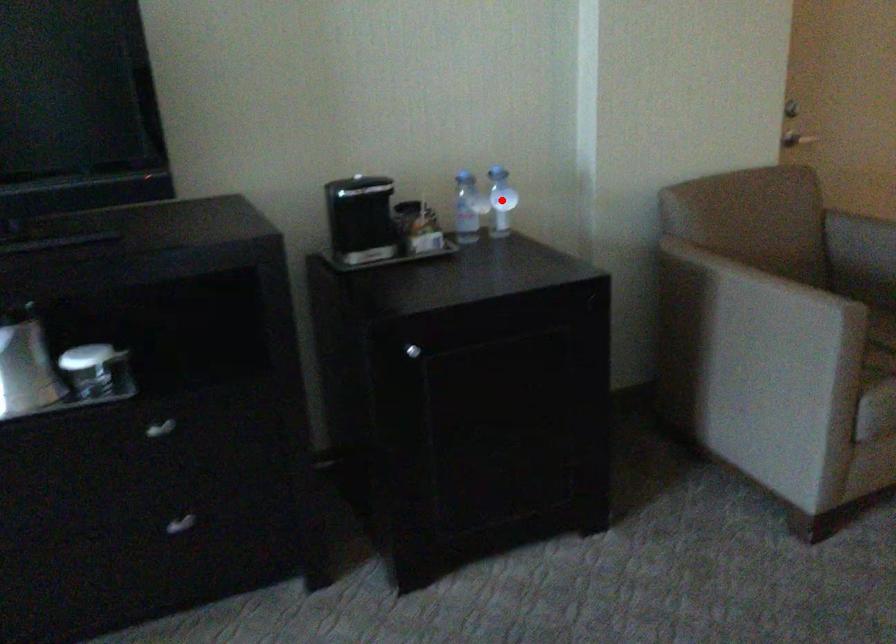
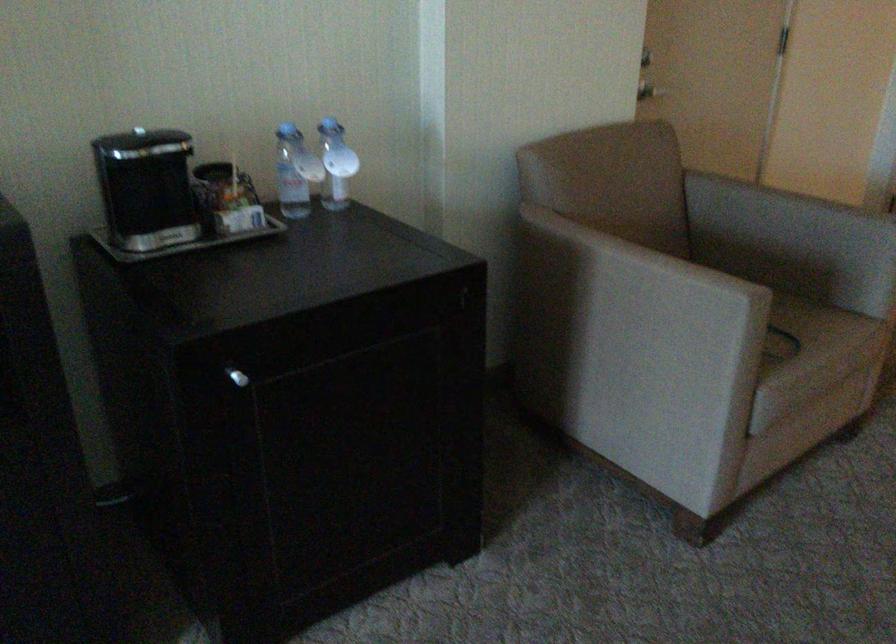
Locate, in the second image, the point that corresponds to the highlighted location in the first image.

(336, 164)